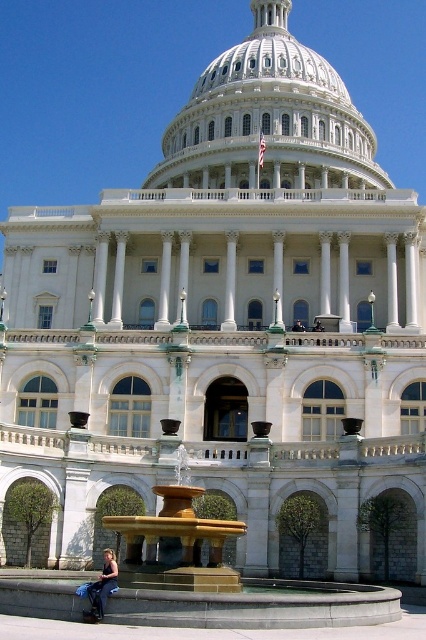
You are a photographer planning to capture a wide shot of the United States Capitol Building. You notice a denim jacket at lower left and a white marble column at center in your frame. Considering their sizes, which object would require more space in your composition to avoid cropping?

The denim jacket at lower left requires more space in the composition because its width is larger than the white marble column at center.

You are a photographer planning to capture a group photo of the two people wearing the denim jacket at lower left and dark blue uniform at center in front of the United States Capitol Building. Which person should you position closer to the camera to ensure both appear equally sized in the photo?

You should position the person wearing the dark blue uniform at center closer to the camera because the denim jacket at lower left is bigger than the dark blue uniform at center. This adjustment will balance their sizes in the photo.

You are standing at the base of the United States Capitol Building and see a denim jacket at lower left and a white marble column at center. If you want to pick up the jacket, which direction should you move relative to the column?

The denim jacket at lower left is 103.39 feet away from the white marble column at center. To reach the jacket, you should move towards the lower left direction relative to the column.